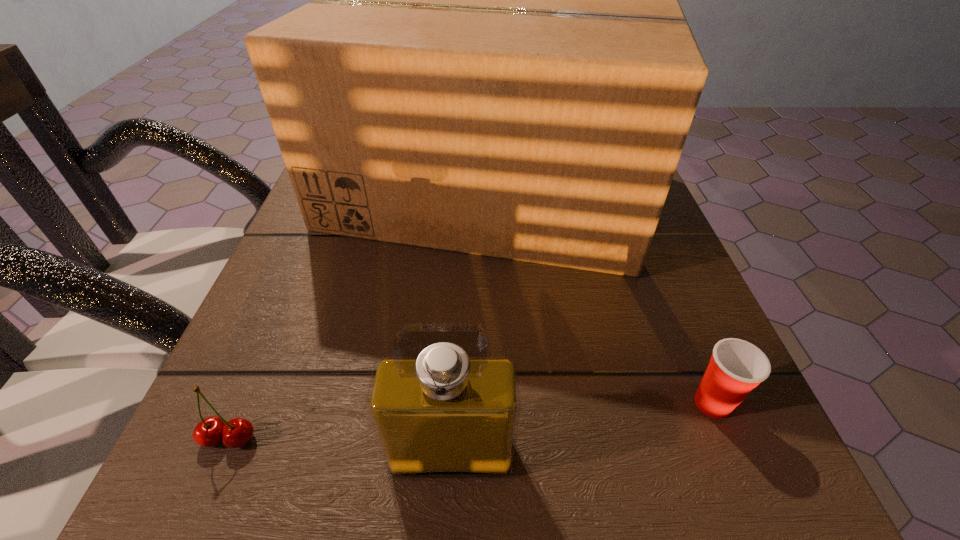
You are a GUI agent. You are given a task and a screenshot of the screen. Output one action in this format:
    pyautogui.click(x=<x>, y=<y>)
    Task: Click on the box
    This screenshot has width=960, height=540.
    Given the screenshot: What is the action you would take?
    coord(495,62)

Where is `the farthest object`? This screenshot has width=960, height=540. the farthest object is located at coordinates (495, 62).

At what (x,y) coordinates should I click in order to perform the action: click on the second tallest object. Please return your answer as a coordinate pair (x, y). Looking at the image, I should click on (439, 407).

Identify the location of Dixie cup. (736, 367).

The width and height of the screenshot is (960, 540). I want to click on cherry, so click(x=209, y=432).

Identify the location of vacant space located 0.260m on the front of the farthest object. (489, 435).

The height and width of the screenshot is (540, 960). Identify the location of free space located on the left of the Dixie cup. (648, 403).

Locate an element on the screen. This screenshot has height=540, width=960. object positioned at the far edge is located at coordinates (495, 62).

You are a GUI agent. You are given a task and a screenshot of the screen. Output one action in this format:
    pyautogui.click(x=<x>, y=<y>)
    Task: Click on the perfume that is at the near edge
    This screenshot has width=960, height=540.
    Given the screenshot: What is the action you would take?
    pyautogui.click(x=439, y=407)

Where is `cherry that is at the near edge`? cherry that is at the near edge is located at coordinates (209, 432).